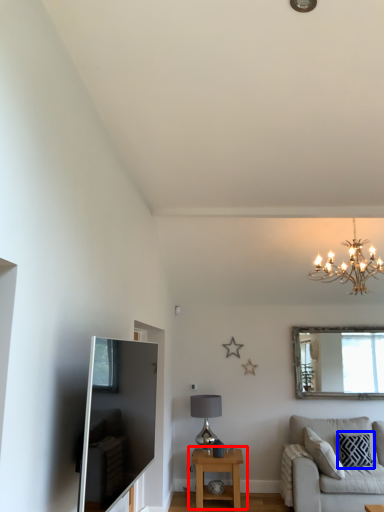
Question: Which of the following is the farthest to the observer, table (highlighted by a red box) or pillow (highlighted by a blue box)?

Choices:
 (A) table
 (B) pillow

Answer: (B)